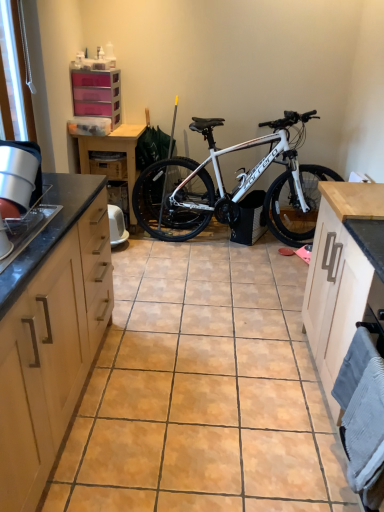
Question: Could you tell me if light wood cabinet at right, marked as the second cabinetry in a bottom-to-top arrangement, is turned towards wooden drawer at center?

Choices:
 (A) yes
 (B) no

Answer: (B)

Question: Can you confirm if light wood cabinet at right, the third cabinetry positioned from the left, is shorter than wooden drawer at center?

Choices:
 (A) yes
 (B) no

Answer: (B)

Question: Does light wood cabinet at right, the 2th cabinetry positioned from the top, have a greater width compared to wooden drawer at center?

Choices:
 (A) no
 (B) yes

Answer: (A)

Question: From a real-world perspective, is light wood cabinet at right, positioned as the 1th cabinetry in right-to-left order, below wooden drawer at center?

Choices:
 (A) no
 (B) yes

Answer: (B)

Question: From a real-world perspective, is light wood cabinet at right, which appears as the second cabinetry when viewed from the front, on top of wooden drawer at center?

Choices:
 (A) yes
 (B) no

Answer: (B)

Question: In terms of height, does light wood cabinet at right, the 2th cabinetry positioned from the top, look taller or shorter compared to white metallic bicycle at center?

Choices:
 (A) short
 (B) tall

Answer: (A)

Question: From the image's perspective, is light wood cabinet at right, the third cabinetry positioned from the left, above or below white metallic bicycle at center?

Choices:
 (A) below
 (B) above

Answer: (A)

Question: Considering the positions of light wood cabinet at right, which appears as the second cabinetry when viewed from the front, and white metallic bicycle at center in the image, is light wood cabinet at right, which appears as the second cabinetry when viewed from the front, bigger or smaller than white metallic bicycle at center?

Choices:
 (A) small
 (B) big

Answer: (A)

Question: Is point (332, 214) closer or farther from the camera than point (297, 189)?

Choices:
 (A) closer
 (B) farther

Answer: (A)

Question: Which is correct: light wood cabinetry at left, the second cabinetry viewed from the right, is inside wooden drawer at center, or outside of it?

Choices:
 (A) outside
 (B) inside

Answer: (A)

Question: From the image's perspective, is light wood cabinetry at left, the second cabinetry viewed from the right, positioned above or below wooden drawer at center?

Choices:
 (A) below
 (B) above

Answer: (A)

Question: Is light wood cabinetry at left, which is counted as the 1th cabinetry, starting from the front, bigger or smaller than wooden drawer at center?

Choices:
 (A) big
 (B) small

Answer: (A)

Question: In terms of height, does light wood cabinetry at left, the 3th cabinetry from the top, look taller or shorter compared to wooden drawer at center?

Choices:
 (A) tall
 (B) short

Answer: (A)

Question: Based on their positions, is pink plastic drawers at upper left, the 3th cabinetry positioned from the front, located to the left or right of wooden drawer at center?

Choices:
 (A) left
 (B) right

Answer: (A)

Question: Is pink plastic drawers at upper left, the 1th cabinetry when ordered from top to bottom, taller or shorter than wooden drawer at center?

Choices:
 (A) short
 (B) tall

Answer: (B)